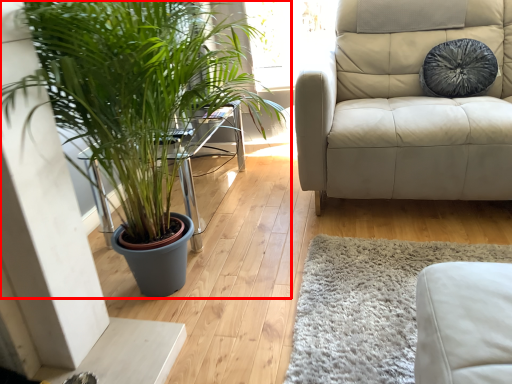
Question: In this image, where is houseplant (annotated by the red box) located relative to pillow?

Choices:
 (A) right
 (B) left

Answer: (B)